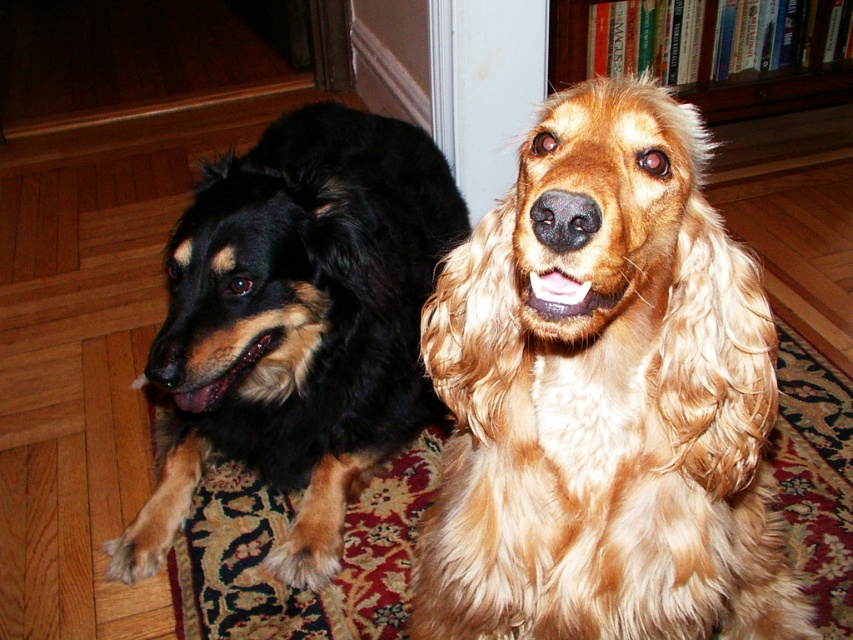
Who is lower down, golden fur dog at center or black fur dog at left?

golden fur dog at center is lower down.

At what (x,y) coordinates should I click in order to perform the action: click on golden fur dog at center. Please return your answer as a coordinate pair (x, y). Looking at the image, I should click on (604, 397).

Does point (721, 316) come closer to viewer compared to point (807, 80)?

Yes, point (721, 316) is in front of point (807, 80).

Who is higher up, golden fur dog at center or wooden bookshelf at upper center?

Positioned higher is wooden bookshelf at upper center.

Between point (454, 385) and point (554, 76), which one is positioned behind?

The point (554, 76) is more distant.

You are a GUI agent. You are given a task and a screenshot of the screen. Output one action in this format:
    pyautogui.click(x=<x>, y=<y>)
    Task: Click on the golden fur dog at center
    The image size is (853, 640).
    Given the screenshot: What is the action you would take?
    pyautogui.click(x=604, y=397)

Is point (271, 360) closer to viewer compared to point (583, 67)?

Yes.

Who is higher up, black fur dog at left or wooden bookshelf at upper center?

Positioned higher is wooden bookshelf at upper center.

Where is `black fur dog at left`? black fur dog at left is located at coordinates (296, 324).